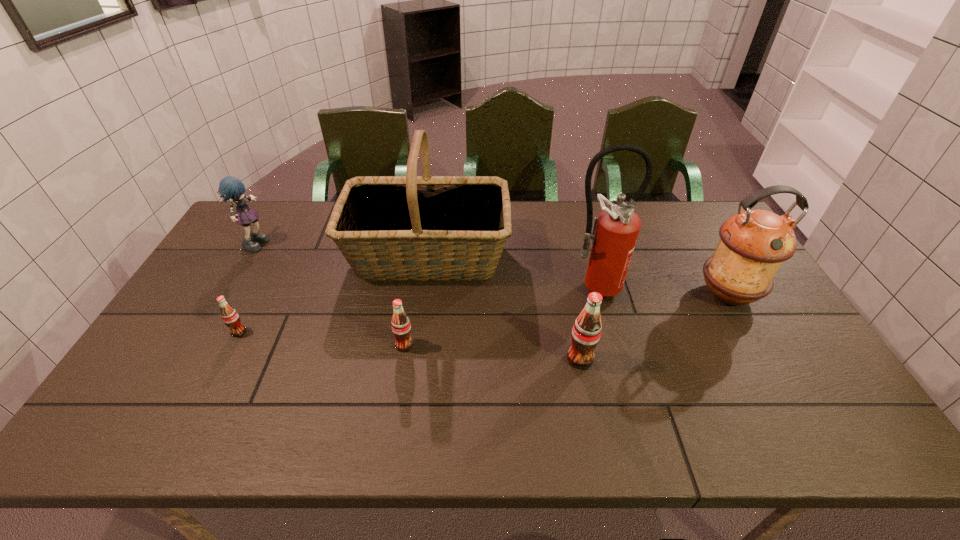
Where is `vacant position in the image that satisfies the following two spatial constraints: 1. on the back side of the tallest soda; 2. on the left side of the rightmost object`? The width and height of the screenshot is (960, 540). vacant position in the image that satisfies the following two spatial constraints: 1. on the back side of the tallest soda; 2. on the left side of the rightmost object is located at coordinates (566, 294).

Identify the location of free space that satisfies the following two spatial constraints: 1. on the front-facing side of the oil lamp; 2. on the left side of the leftmost object. (227, 294).

This screenshot has height=540, width=960. Find the location of `free space that satisfies the following two spatial constraints: 1. by the handle of the oil lamp; 2. on the left side of the basket`. free space that satisfies the following two spatial constraints: 1. by the handle of the oil lamp; 2. on the left side of the basket is located at coordinates coord(422,294).